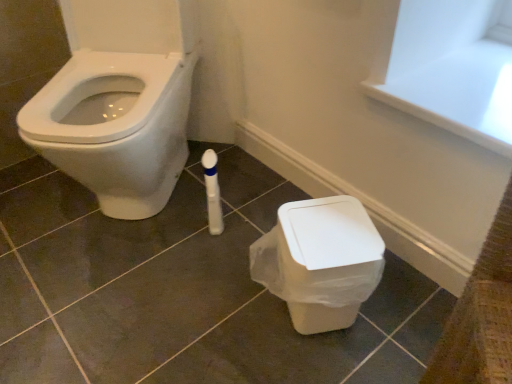
The height and width of the screenshot is (384, 512). Identify the location of empty space that is in between white glossy bidet at left and white plastic bin at lower right. (201, 245).